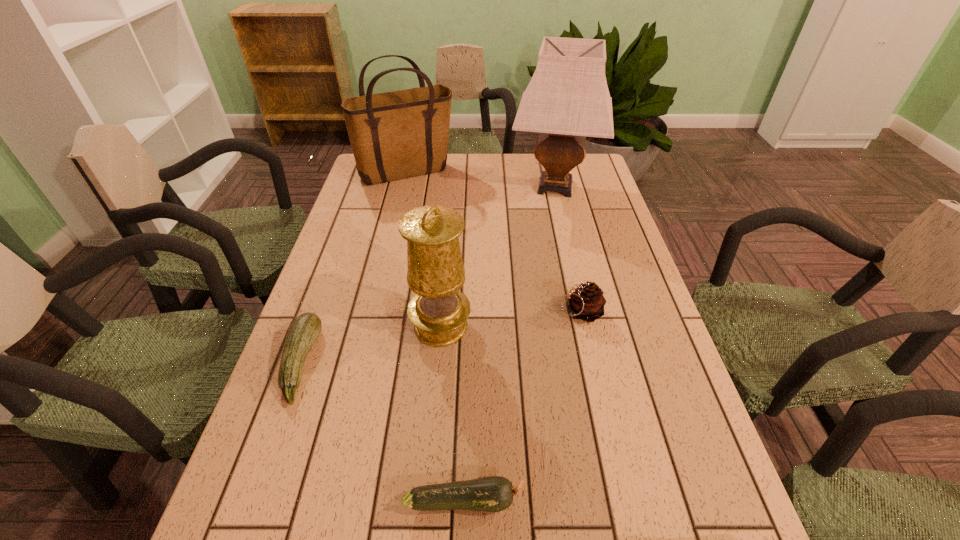
The height and width of the screenshot is (540, 960). I want to click on the fifth closest object to the nearer zucchini, so click(400, 134).

Identify the location of zucchini that is the second closest to the fourth tallest object. (305, 329).

Image resolution: width=960 pixels, height=540 pixels. Find the location of `free space that satisfies the following two spatial constraints: 1. on the front side of the oil lamp; 2. on the right side of the tote bag`. free space that satisfies the following two spatial constraints: 1. on the front side of the oil lamp; 2. on the right side of the tote bag is located at coordinates (371, 326).

Where is `free region that satisfies the following two spatial constraints: 1. on the front side of the tallest object; 2. on the left side of the tote bag`? This screenshot has width=960, height=540. free region that satisfies the following two spatial constraints: 1. on the front side of the tallest object; 2. on the left side of the tote bag is located at coordinates (403, 187).